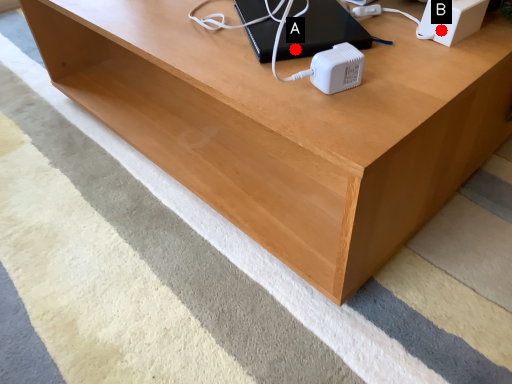
Question: Two points are circled on the image, labeled by A and B beside each circle. Which point is closer to the camera?

Choices:
 (A) A is closer
 (B) B is closer

Answer: (A)